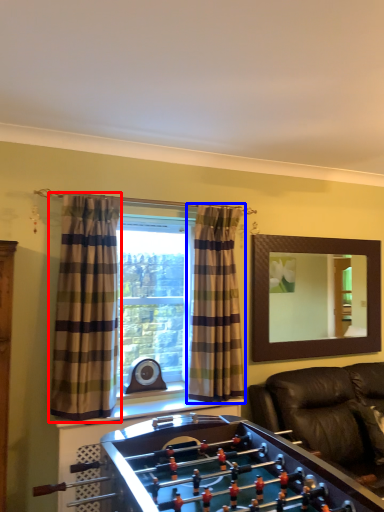
Question: Among these objects, which one is nearest to the camera, curtain (highlighted by a red box) or curtain (highlighted by a blue box)?

Choices:
 (A) curtain
 (B) curtain

Answer: (A)